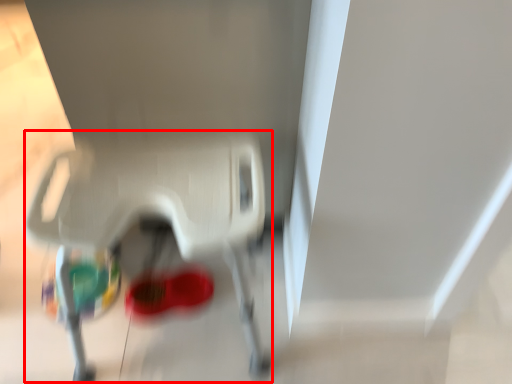
Question: Considering the relative positions of baby carriage (annotated by the red box) and footwear in the image provided, where is baby carriage (annotated by the red box) located with respect to the staircase?

Choices:
 (A) right
 (B) left

Answer: (A)